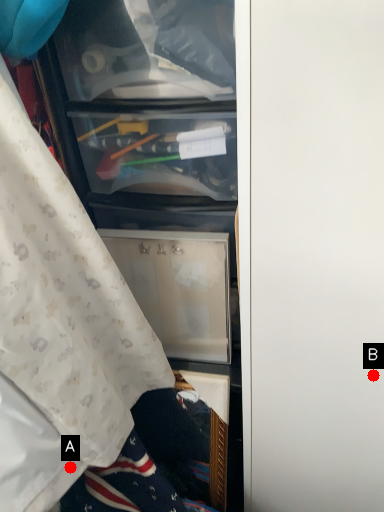
Question: Two points are circled on the image, labeled by A and B beside each circle. Which point is farther to the camera?

Choices:
 (A) A is further
 (B) B is further

Answer: (A)